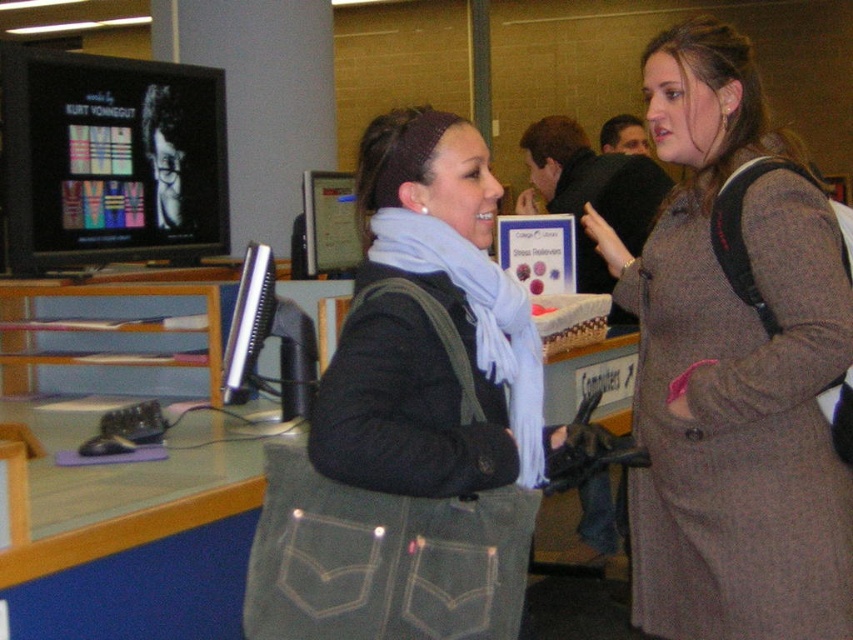
Question: Observing the image, what is the correct spatial positioning of gray wool coat at center in reference to matte black monitor at upper left?

Choices:
 (A) right
 (B) left

Answer: (A)

Question: Which is farther from the matte black monitor at upper left?

Choices:
 (A) gray wool coat at center
 (B) matte black jacket at center

Answer: (A)

Question: Considering the relative positions of gray wool coat at center and matte black jacket at center in the image provided, where is gray wool coat at center located with respect to matte black jacket at center?

Choices:
 (A) right
 (B) left

Answer: (A)

Question: Which of the following is the closest to the observer?

Choices:
 (A) gray wool coat at center
 (B) matte black monitor at upper left

Answer: (A)

Question: Is matte black jacket at center bigger than matte black monitor at upper left?

Choices:
 (A) no
 (B) yes

Answer: (B)

Question: Which of the following is the closest to the observer?

Choices:
 (A) matte black jacket at center
 (B) gray wool coat at center
 (C) matte black monitor at upper left

Answer: (A)